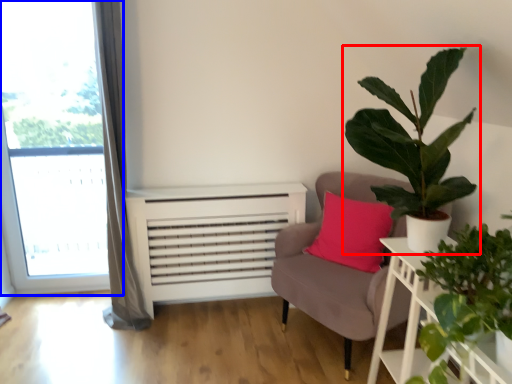
Question: Among these objects, which one is nearest to the camera, houseplant (highlighted by a red box) or window (highlighted by a blue box)?

Choices:
 (A) houseplant
 (B) window

Answer: (A)